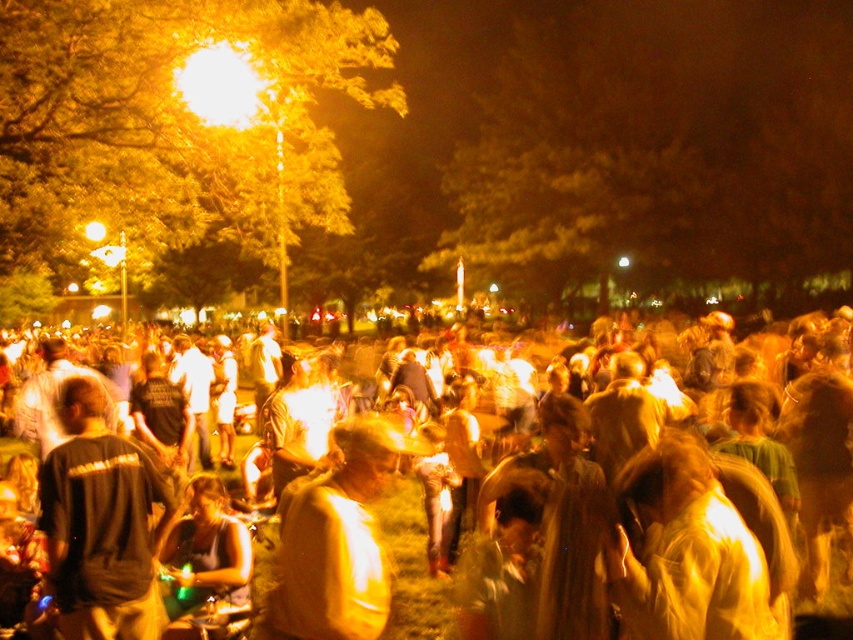
What do you see at coordinates (639, 563) in the screenshot?
I see `yellowish fabric crowd at center` at bounding box center [639, 563].

Consider the image. Who is more distant from viewer, (386,461) or (363,467)?

The point (386,461) is behind.

Is point (614, 548) closer to camera compared to point (363, 518)?

Yes, point (614, 548) is closer to viewer.

Locate an element on the screen. yellowish fabric crowd at center is located at coordinates (639, 563).

Is black matte shirt at center positioned behind shiny gold jacket at center?

Yes.

Who is more distant from viewer, (119,536) or (367,525)?

Positioned behind is point (119,536).

Identify the location of black matte shirt at center. (102, 522).

Where is `black matte shirt at center`? black matte shirt at center is located at coordinates (102, 522).

Measure the distance between yellowish fabric crowd at center and black matte shirt at center.

yellowish fabric crowd at center and black matte shirt at center are 2.24 meters apart.

Is yellowish fabric crowd at center further to camera compared to black matte shirt at center?

No, it is in front of black matte shirt at center.

Which is in front, point (345, 444) or point (57, 598)?

Point (345, 444) is in front.

Identify the location of yellowish fabric crowd at center. (639, 563).